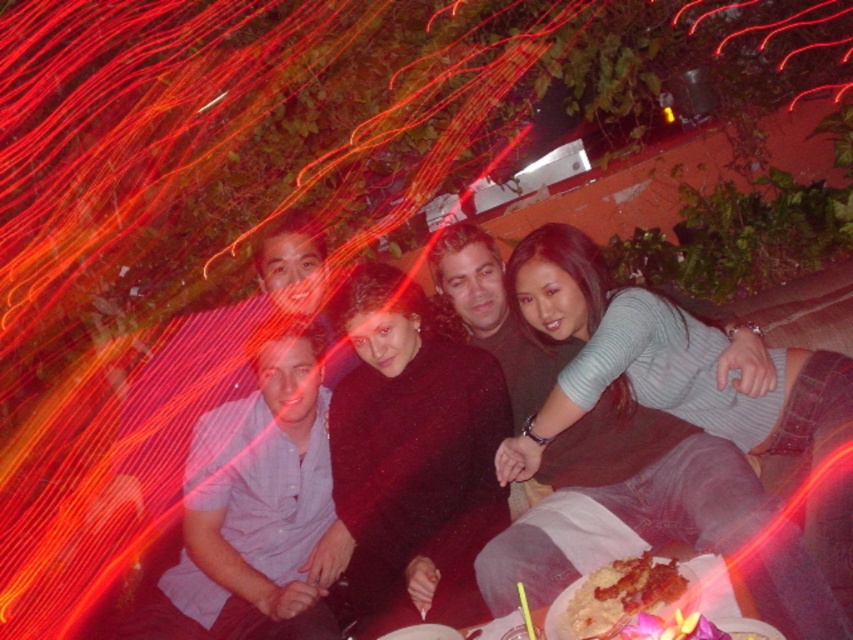
Who is shorter, light blue sweater at center or golden crispy chicken at lower center?

Standing shorter between the two is golden crispy chicken at lower center.

Between light blue sweater at center and golden crispy chicken at lower center, which one appears on the right side from the viewer's perspective?

light blue sweater at center is more to the right.

Is point (578, 289) farther from camera compared to point (596, 600)?

Yes, point (578, 289) is behind point (596, 600).

This screenshot has width=853, height=640. Identify the location of light blue sweater at center. (659, 362).